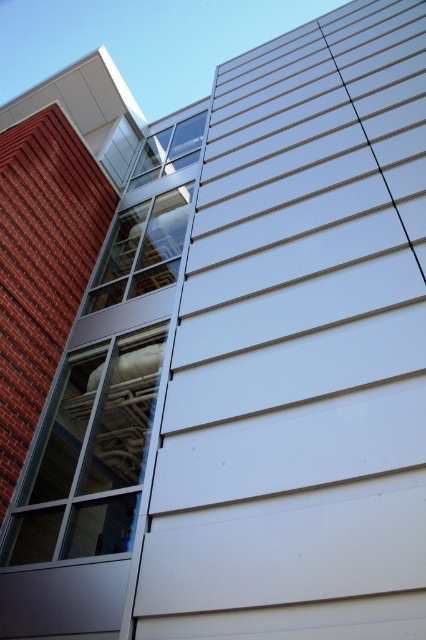
Question: Which object is closer to the camera taking this photo?

Choices:
 (A) clear glass window at upper center
 (B) red brick siding at left
 (C) clear glass window at center
 (D) clear glass window at center-left

Answer: (C)

Question: Is clear glass window at center positioned at the back of clear glass window at upper center?

Choices:
 (A) no
 (B) yes

Answer: (A)

Question: Does red brick siding at left lie in front of clear glass window at center?

Choices:
 (A) no
 (B) yes

Answer: (A)

Question: Does clear glass window at center-left lie in front of clear glass window at upper center?

Choices:
 (A) no
 (B) yes

Answer: (B)

Question: Which point is closer to the camera?

Choices:
 (A) clear glass window at center-left
 (B) clear glass window at center

Answer: (B)

Question: Estimate the real-world distances between objects in this image. Which object is closer to the clear glass window at upper center?

Choices:
 (A) red brick siding at left
 (B) clear glass window at center

Answer: (A)